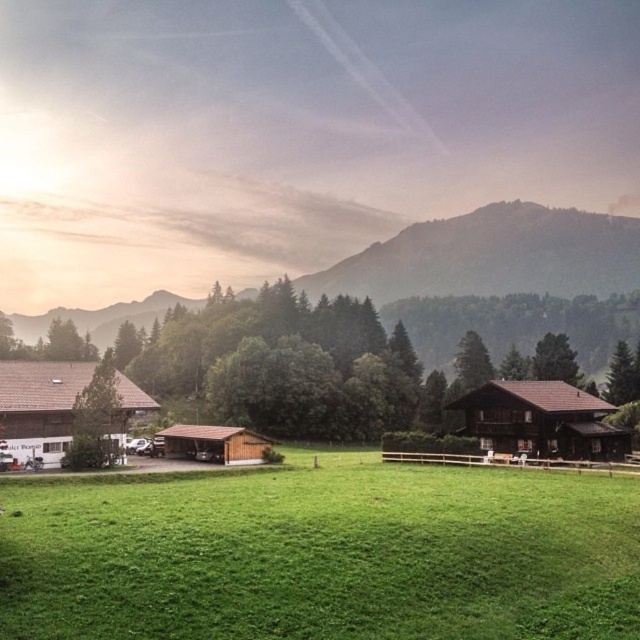
Question: Which point is closer to the camera taking this photo?

Choices:
 (A) (227, 428)
 (B) (22, 360)
 (C) (541, 520)
 (D) (547, 420)

Answer: (C)

Question: Which point appears closest to the camera in this image?

Choices:
 (A) (168, 426)
 (B) (298, 620)
 (C) (76, 381)

Answer: (B)

Question: Does green grassy field at center have a smaller size compared to brown wooden hut at center?

Choices:
 (A) no
 (B) yes

Answer: (A)

Question: Can you confirm if brown wooden house at center-right is positioned to the right of brown wooden hut at center?

Choices:
 (A) no
 (B) yes

Answer: (B)

Question: Is green grassy field at center wider than brown wooden house at center-right?

Choices:
 (A) yes
 (B) no

Answer: (A)

Question: Which object is farther from the camera taking this photo?

Choices:
 (A) brown wooden house at center-right
 (B) green grassy field at center
 (C) brown wooden hut at lower left
 (D) brown wooden hut at center

Answer: (D)